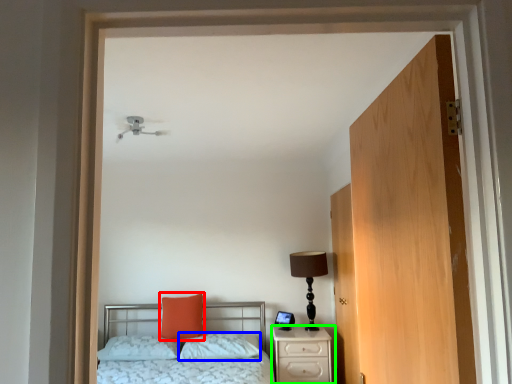
Question: Estimate the real-world distances between objects in this image. Which object is farther from pillow (highlighted by a red box), pillow (highlighted by a blue box) or nightstand (highlighted by a green box)?

Choices:
 (A) pillow
 (B) nightstand

Answer: (B)